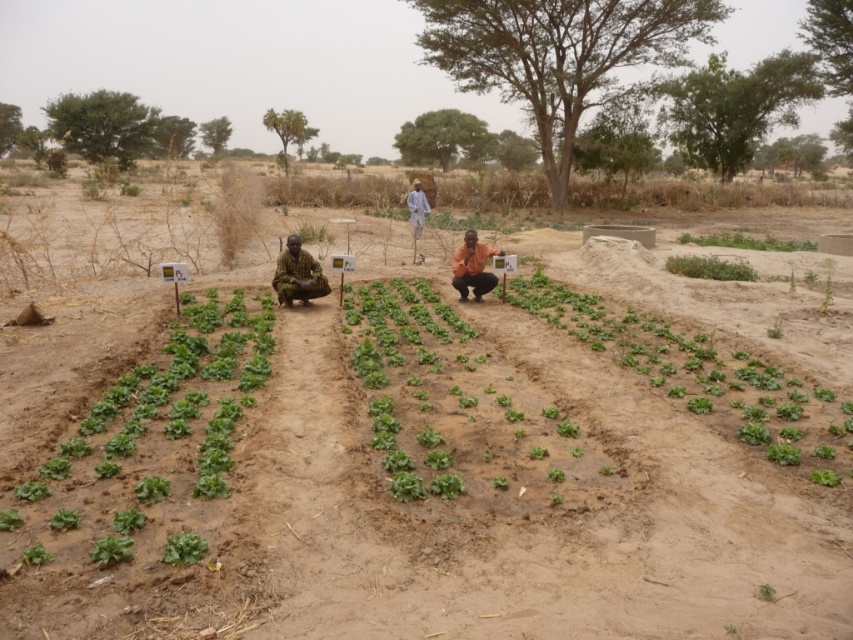
You are standing at the point with coordinates [149,435] in the image. What object is located to your immediate left?

The green leafy at left is located to your immediate left at point [149,435].

Please look at the coordinates provided in the image. What object is located at point (297, 275)?

The brown textured fabric at center is located at point (297, 275).

You are a farmer standing at the point marked as point [457,406]. You want to check the growth of the green leafy vegetable at center. Is the vegetable located directly in front of you, or to your side?

The green leafy vegetable at center is located directly in front of you at point [457,406].